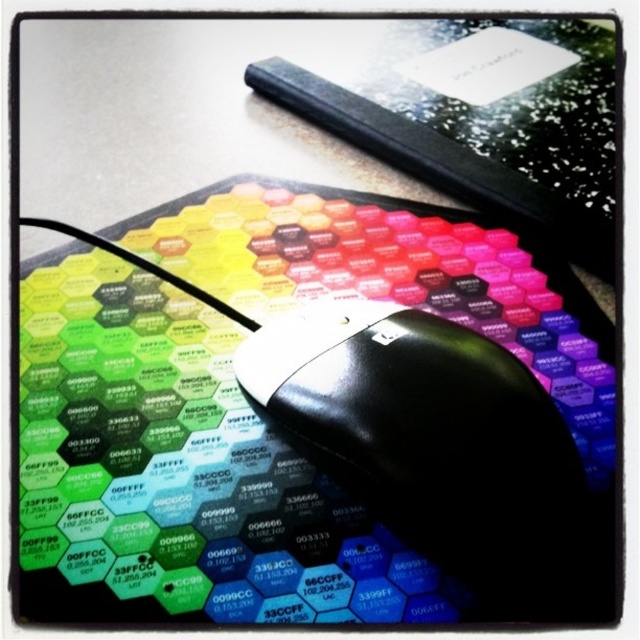
Question: Which point is farther from the camera taking this photo?

Choices:
 (A) (148, 356)
 (B) (368, 404)

Answer: (A)

Question: Is hexagonal patterned mousepad at center bigger than black plastic mouse at center?

Choices:
 (A) no
 (B) yes

Answer: (B)

Question: Which object is closer to the camera taking this photo?

Choices:
 (A) black plastic mouse at center
 (B) hexagonal patterned mousepad at center

Answer: (A)

Question: From the image, what is the correct spatial relationship of hexagonal patterned mousepad at center in relation to black plastic mouse at center?

Choices:
 (A) below
 (B) above

Answer: (B)

Question: Which point is farther to the camera?

Choices:
 (A) hexagonal patterned mousepad at center
 (B) black plastic mouse at center

Answer: (A)

Question: Is hexagonal patterned mousepad at center positioned in front of black plastic mouse at center?

Choices:
 (A) yes
 (B) no

Answer: (B)